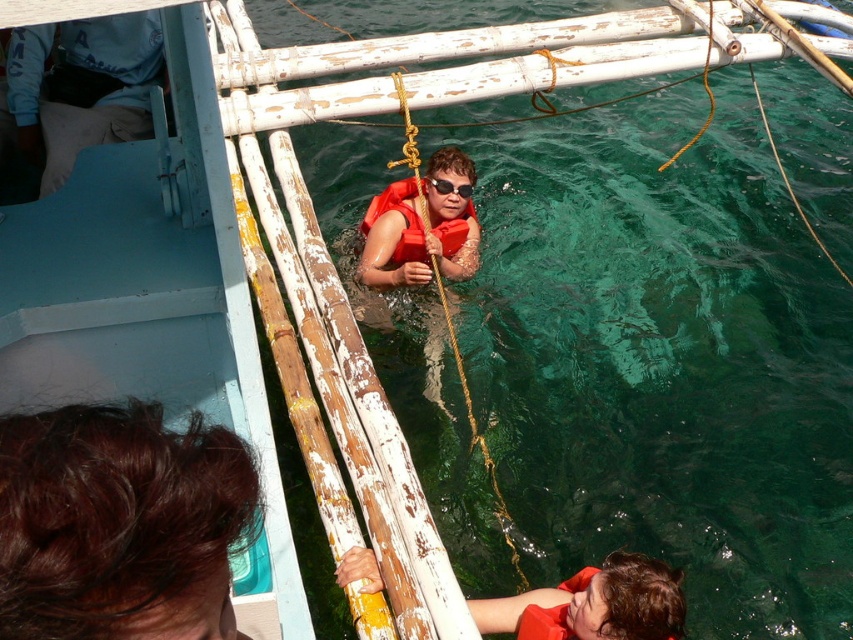
Question: Does matte orange life vest at lower center appear under black plastic goggles at center?

Choices:
 (A) no
 (B) yes

Answer: (B)

Question: Estimate the real-world distances between objects in this image. Which object is farther from the matte orange life vest at lower center?

Choices:
 (A) dark brown hair at lower left
 (B) orange life jacket at center

Answer: (B)

Question: Can you confirm if dark brown hair at lower left is smaller than orange life jacket at center?

Choices:
 (A) yes
 (B) no

Answer: (A)

Question: Is dark brown hair at lower left positioned at the back of orange life jacket at center?

Choices:
 (A) no
 (B) yes

Answer: (A)

Question: Which point is farther to the camera?

Choices:
 (A) dark brown hair at lower left
 (B) matte orange life vest at lower center
 (C) black plastic goggles at center

Answer: (C)

Question: Which point is farther to the camera?

Choices:
 (A) (172, 435)
 (B) (462, 189)
 (C) (592, 616)
 (D) (421, 257)

Answer: (D)